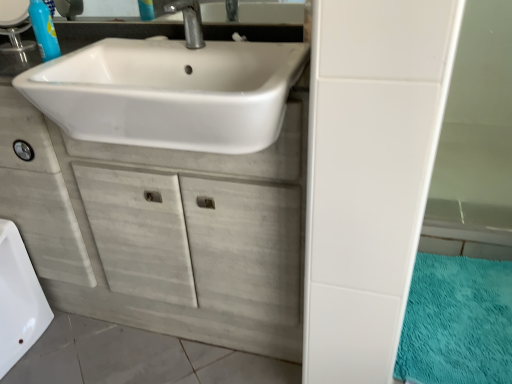
Question: Is point (31, 14) positioned closer to the camera than point (505, 286)?

Choices:
 (A) farther
 (B) closer

Answer: (B)

Question: Considering their positions, is blue plastic soap dispenser at upper left located in front of or behind teal plush bath mat at lower right?

Choices:
 (A) front
 (B) behind

Answer: (B)

Question: Estimate the real-world distances between objects in this image. Which object is farther from the blue plastic soap dispenser at upper left?

Choices:
 (A) metallic silver faucet at upper center
 (B) white wood cabinet at center
 (C) white glossy bath at lower left
 (D) white glossy sink at upper center
 (E) teal plush bath mat at lower right

Answer: (E)

Question: Estimate the real-world distances between objects in this image. Which object is farther from the white glossy sink at upper center?

Choices:
 (A) white glossy bath at lower left
 (B) metallic silver faucet at upper center
 (C) teal plush bath mat at lower right
 (D) blue plastic soap dispenser at upper left
 (E) white wood cabinet at center

Answer: (C)